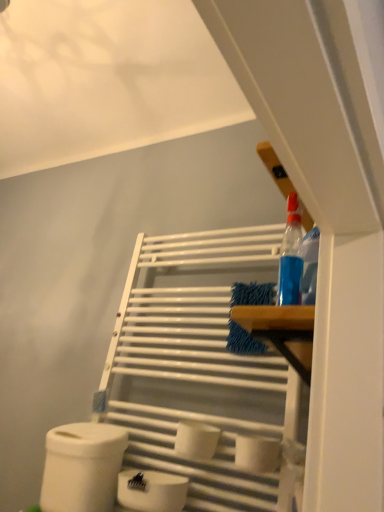
Question: Which direction should I rotate to look at white matte toilet paper at center, which ranks as the 4th toilet paper in left-to-right order, — up or down?

Choices:
 (A) up
 (B) down

Answer: (B)

Question: From a real-world perspective, does white matte toilet paper at center, which is the third toilet paper in left-to-right order, sit lower than white matte toilet paper at lower center, positioned as the second toilet paper in left-to-right order?

Choices:
 (A) yes
 (B) no

Answer: (B)

Question: Would you say white matte toilet paper at lower center, positioned as the second toilet paper in left-to-right order, is part of white matte toilet paper at center, which is the third toilet paper in left-to-right order,'s contents?

Choices:
 (A) no
 (B) yes

Answer: (A)

Question: Considering the relative sizes of white matte toilet paper at center, which is counted as the second toilet paper, starting from the right, and white matte toilet paper at lower center, positioned as the second toilet paper in left-to-right order, in the image provided, is white matte toilet paper at center, which is counted as the second toilet paper, starting from the right, thinner than white matte toilet paper at lower center, positioned as the second toilet paper in left-to-right order,?

Choices:
 (A) yes
 (B) no

Answer: (B)

Question: Could you tell me if white matte toilet paper at center, which is the third toilet paper in left-to-right order, is facing white matte toilet paper at lower center, the 3th toilet paper in the right-to-left sequence?

Choices:
 (A) yes
 (B) no

Answer: (B)

Question: Is white matte toilet paper at center, which is counted as the second toilet paper, starting from the right, at the left side of white matte toilet paper at lower center, positioned as the second toilet paper in left-to-right order?

Choices:
 (A) no
 (B) yes

Answer: (A)

Question: Are white matte toilet paper at center, which is counted as the second toilet paper, starting from the right, and white matte toilet paper at lower center, positioned as the second toilet paper in left-to-right order, making contact?

Choices:
 (A) yes
 (B) no

Answer: (B)

Question: From the image's perspective, is blue microfiber cloth at center below white matte toilet paper at lower center, positioned as the second toilet paper in left-to-right order?

Choices:
 (A) yes
 (B) no

Answer: (B)

Question: Could you tell me if blue microfiber cloth at center is turned towards white matte toilet paper at lower center, the 3th toilet paper in the right-to-left sequence?

Choices:
 (A) no
 (B) yes

Answer: (A)

Question: From a real-world perspective, does blue microfiber cloth at center stand above white matte toilet paper at lower center, the 3th toilet paper in the right-to-left sequence?

Choices:
 (A) yes
 (B) no

Answer: (A)

Question: From a real-world perspective, is blue microfiber cloth at center positioned under white matte toilet paper at lower center, positioned as the second toilet paper in left-to-right order, based on gravity?

Choices:
 (A) yes
 (B) no

Answer: (B)

Question: Considering the relative positions of blue microfiber cloth at center and white matte toilet paper at lower center, the 3th toilet paper in the right-to-left sequence, in the image provided, is blue microfiber cloth at center behind white matte toilet paper at lower center, the 3th toilet paper in the right-to-left sequence,?

Choices:
 (A) yes
 (B) no

Answer: (A)

Question: Would you say blue microfiber cloth at center is outside white matte toilet paper at lower center, positioned as the second toilet paper in left-to-right order?

Choices:
 (A) yes
 (B) no

Answer: (A)

Question: Does white matte toilet paper at center, which ranks as the 4th toilet paper in left-to-right order, contain white matte toilet paper at lower center, the 3th toilet paper in the right-to-left sequence?

Choices:
 (A) yes
 (B) no

Answer: (B)